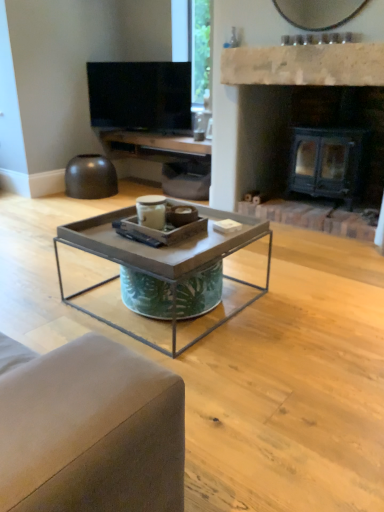
Question: Would you say metal/texturedcoffee table at center contains white stone fireplace at upper center?

Choices:
 (A) yes
 (B) no

Answer: (B)

Question: From a real-world perspective, is metal/texturedcoffee table at center positioned under white stone fireplace at upper center based on gravity?

Choices:
 (A) yes
 (B) no

Answer: (A)

Question: Is metal/texturedcoffee table at center not inside white stone fireplace at upper center?

Choices:
 (A) no
 (B) yes

Answer: (B)

Question: Does metal/texturedcoffee table at center come behind white stone fireplace at upper center?

Choices:
 (A) no
 (B) yes

Answer: (A)

Question: Is metal/texturedcoffee table at center oriented away from white stone fireplace at upper center?

Choices:
 (A) yes
 (B) no

Answer: (B)

Question: In terms of height, does black metal fireplace at center look taller or shorter compared to matte wood entertainment center at upper center?

Choices:
 (A) tall
 (B) short

Answer: (A)

Question: From a real-world perspective, relative to matte wood entertainment center at upper center, is black metal fireplace at center vertically above or below?

Choices:
 (A) above
 (B) below

Answer: (A)

Question: From the image's perspective, relative to matte wood entertainment center at upper center, is black metal fireplace at center above or below?

Choices:
 (A) above
 (B) below

Answer: (B)

Question: In terms of width, does black metal fireplace at center look wider or thinner when compared to matte wood entertainment center at upper center?

Choices:
 (A) wide
 (B) thin

Answer: (A)

Question: In terms of size, does flat screen tv at upper center appear bigger or smaller than matte wood entertainment center at upper center?

Choices:
 (A) big
 (B) small

Answer: (B)

Question: Is flat screen tv at upper center in front of or behind matte wood entertainment center at upper center in the image?

Choices:
 (A) behind
 (B) front

Answer: (A)

Question: Considering the positions of flat screen tv at upper center and matte wood entertainment center at upper center in the image, is flat screen tv at upper center wider or thinner than matte wood entertainment center at upper center?

Choices:
 (A) thin
 (B) wide

Answer: (A)

Question: Is point (125, 64) positioned closer to the camera than point (180, 184)?

Choices:
 (A) farther
 (B) closer

Answer: (A)

Question: In terms of size, does white stone fireplace at upper center appear bigger or smaller than flat screen tv at upper center?

Choices:
 (A) small
 (B) big

Answer: (A)

Question: Is white stone fireplace at upper center taller or shorter than flat screen tv at upper center?

Choices:
 (A) tall
 (B) short

Answer: (B)